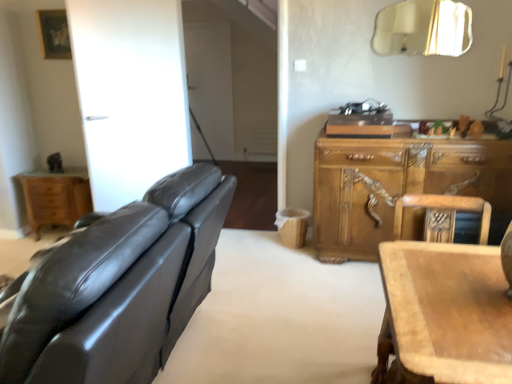
The image size is (512, 384). Describe the element at coordinates (122, 287) in the screenshot. I see `matte black leather couch at left` at that location.

I want to click on gold metallic mirror at upper right, so click(423, 28).

Where is `light brown wood nightstand at left`? light brown wood nightstand at left is located at coordinates (55, 197).

Locate an element on the screen. wooden carved cabinet at right is located at coordinates (398, 186).

Where is `matte black leather couch at left`? This screenshot has width=512, height=384. matte black leather couch at left is located at coordinates (122, 287).

Is wooden chair at right wider or thinner than matte black leather couch at left?

Considering their sizes, wooden chair at right looks slimmer than matte black leather couch at left.

Between wooden chair at right and matte black leather couch at left, which one has smaller size?

wooden chair at right is smaller.

Does wooden chair at right have a greater height compared to matte black leather couch at left?

No, wooden chair at right is not taller than matte black leather couch at left.

Consider the image. From the image's perspective, which is above, wooden chair at right or matte black leather couch at left?

matte black leather couch at left appears higher in the image.

Between light brown wood nightstand at left and wooden chair at right, which one is positioned in front?

wooden chair at right.

Is light brown wood nightstand at left touching wooden chair at right?

light brown wood nightstand at left is not next to wooden chair at right, and they're not touching.

Is light brown wood nightstand at left taller than wooden chair at right?

No, light brown wood nightstand at left is not taller than wooden chair at right.

Between wooden carved cabinet at right and matte black leather couch at left, which one has smaller width?

Thinner between the two is wooden carved cabinet at right.

Is wooden carved cabinet at right not near matte black leather couch at left?

Yes, wooden carved cabinet at right and matte black leather couch at left are quite far apart.

In the scene shown: Choose the correct answer: Is wooden carved cabinet at right inside matte black leather couch at left or outside it?

The correct answer is: outside.

Considering the positions of points (48, 192) and (403, 47), is point (48, 192) closer to camera compared to point (403, 47)?

No, it is not.

Which object is wider, light brown wood nightstand at left or gold metallic mirror at upper right?

light brown wood nightstand at left is wider.

Measure the distance between light brown wood nightstand at left and gold metallic mirror at upper right.

2.88 meters.

Where is `nightstand located underneath the gold metallic mirror at upper right (from a real-world perspective)`? This screenshot has width=512, height=384. nightstand located underneath the gold metallic mirror at upper right (from a real-world perspective) is located at coordinates (55, 197).

Is light brown wood nightstand at left oriented away from wooden carved cabinet at right?

No, light brown wood nightstand at left's orientation is not away from wooden carved cabinet at right.

Is the surface of light brown wood nightstand at left in direct contact with wooden carved cabinet at right?

No, light brown wood nightstand at left is not making contact with wooden carved cabinet at right.

From a real-world perspective, who is located lower, light brown wood nightstand at left or wooden carved cabinet at right?

In real-world perspective, light brown wood nightstand at left is lower.

How far apart are gold metallic mirror at upper right and wooden chair at right?

5.38 feet.

You are a GUI agent. You are given a task and a screenshot of the screen. Output one action in this format:
    pyautogui.click(x=<x>, y=<y>)
    Task: Click on the mirror above the wooden chair at right (from a real-world perspective)
    The height and width of the screenshot is (384, 512).
    Given the screenshot: What is the action you would take?
    pyautogui.click(x=423, y=28)

From the picture: Considering the relative sizes of gold metallic mirror at upper right and wooden chair at right in the image provided, is gold metallic mirror at upper right smaller than wooden chair at right?

Correct, gold metallic mirror at upper right occupies less space than wooden chair at right.

Is gold metallic mirror at upper right next to wooden chair at right and touching it?

No, gold metallic mirror at upper right is not touching wooden chair at right.

Between wooden chair at right and light brown wood nightstand at left, which one appears on the right side from the viewer's perspective?

Positioned to the right is wooden chair at right.

From their relative heights in the image, would you say wooden chair at right is taller or shorter than light brown wood nightstand at left?

wooden chair at right is taller than light brown wood nightstand at left.

What's the angular difference between wooden chair at right and light brown wood nightstand at left's facing directions?

12.5 degrees.

From the image's perspective, is wooden chair at right positioned above or below light brown wood nightstand at left?

wooden chair at right is situated lower than light brown wood nightstand at left in the image.

You are a GUI agent. You are given a task and a screenshot of the screen. Output one action in this format:
    pyautogui.click(x=<x>, y=<y>)
    Task: Click on the chair below the matte black leather couch at left (from the image's perspective)
    The image size is (512, 384).
    Given the screenshot: What is the action you would take?
    pyautogui.click(x=443, y=210)

You are a GUI agent. You are given a task and a screenshot of the screen. Output one action in this format:
    pyautogui.click(x=<x>, y=<y>)
    Task: Click on the nightstand on the left of wooden chair at right
    
    Given the screenshot: What is the action you would take?
    [55, 197]

Based on their spatial positions, is gold metallic mirror at upper right or matte black leather couch at left further from light brown wood nightstand at left?

The object further to light brown wood nightstand at left is gold metallic mirror at upper right.

Looking at the image, which one is located closer to wooden carved cabinet at right, light brown wood nightstand at left or matte black leather couch at left?

Among the two, matte black leather couch at left is located nearer to wooden carved cabinet at right.

Consider the image. Which object lies further to the anchor point wooden carved cabinet at right, matte black leather couch at left or wooden chair at right?

Among the two, matte black leather couch at left is located further to wooden carved cabinet at right.

Consider the image. When comparing their distances from wooden chair at right, does light brown wood nightstand at left or wooden carved cabinet at right seem closer?

wooden carved cabinet at right is positioned closer to the anchor wooden chair at right.

From the image, which object appears to be nearer to light brown wood nightstand at left, wooden carved cabinet at right or matte black leather couch at left?

matte black leather couch at left.

When comparing their distances from wooden carved cabinet at right, does light brown wood nightstand at left or gold metallic mirror at upper right seem further?

The object further to wooden carved cabinet at right is light brown wood nightstand at left.

Considering their positions, is wooden chair at right positioned closer to wooden carved cabinet at right than light brown wood nightstand at left?

Based on the image, wooden chair at right appears to be nearer to wooden carved cabinet at right.

Looking at the image, which one is located further to gold metallic mirror at upper right, wooden carved cabinet at right or light brown wood nightstand at left?

The object further to gold metallic mirror at upper right is light brown wood nightstand at left.

Where is `cabinetry between light brown wood nightstand at left and gold metallic mirror at upper right in the horizontal direction`? Image resolution: width=512 pixels, height=384 pixels. cabinetry between light brown wood nightstand at left and gold metallic mirror at upper right in the horizontal direction is located at coordinates (398, 186).

This screenshot has height=384, width=512. I want to click on chair situated between light brown wood nightstand at left and wooden carved cabinet at right from left to right, so click(x=443, y=210).

The image size is (512, 384). What are the coordinates of `studio couch between light brown wood nightstand at left and gold metallic mirror at upper right from left to right` in the screenshot? It's located at (122, 287).

Where is `chair between matte black leather couch at left and wooden carved cabinet at right`? chair between matte black leather couch at left and wooden carved cabinet at right is located at coordinates (443, 210).